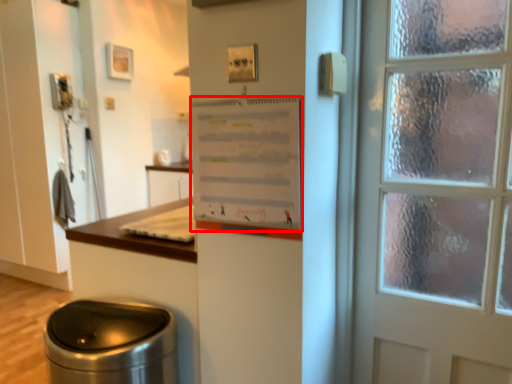
Question: Where is poster (annotated by the red box) located in relation to waste container in the image?

Choices:
 (A) left
 (B) right

Answer: (B)